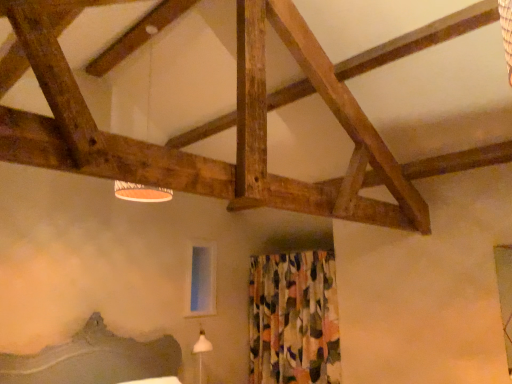
Question: From the image's perspective, is white fabric lampshade at upper center on top of transparent glass window screen at center?

Choices:
 (A) no
 (B) yes

Answer: (B)

Question: Does white fabric lampshade at upper center have a lesser width compared to transparent glass window screen at center?

Choices:
 (A) yes
 (B) no

Answer: (B)

Question: Is white fabric lampshade at upper center touching transparent glass window screen at center?

Choices:
 (A) yes
 (B) no

Answer: (B)

Question: From the image's perspective, does white fabric lampshade at upper center appear lower than transparent glass window screen at center?

Choices:
 (A) yes
 (B) no

Answer: (B)

Question: Is white fabric lampshade at upper center not near transparent glass window screen at center?

Choices:
 (A) yes
 (B) no

Answer: (B)

Question: In the image, is transparent glass window screen at center positioned in front of or behind white fabric lampshade at upper center?

Choices:
 (A) front
 (B) behind

Answer: (B)

Question: Looking at their shapes, would you say transparent glass window screen at center is wider or thinner than white fabric lampshade at upper center?

Choices:
 (A) wide
 (B) thin

Answer: (B)

Question: Would you say transparent glass window screen at center is to the left or to the right of white fabric lampshade at upper center in the picture?

Choices:
 (A) left
 (B) right

Answer: (B)

Question: Is transparent glass window screen at center taller or shorter than white fabric lampshade at upper center?

Choices:
 (A) tall
 (B) short

Answer: (B)

Question: Choose the correct answer: Is transparent glass window screen at center inside floral fabric curtain at center or outside it?

Choices:
 (A) inside
 (B) outside

Answer: (B)

Question: Is point (196, 246) positioned closer to the camera than point (312, 281)?

Choices:
 (A) farther
 (B) closer

Answer: (A)

Question: Considering the positions of transparent glass window screen at center and floral fabric curtain at center in the image, is transparent glass window screen at center taller or shorter than floral fabric curtain at center?

Choices:
 (A) short
 (B) tall

Answer: (A)

Question: Looking at the image, does transparent glass window screen at center seem bigger or smaller compared to floral fabric curtain at center?

Choices:
 (A) small
 (B) big

Answer: (A)

Question: Does point (117, 187) appear closer or farther from the camera than point (193, 281)?

Choices:
 (A) closer
 (B) farther

Answer: (A)

Question: Is white fabric lampshade at upper center situated inside transparent glass window screen at center or outside?

Choices:
 (A) inside
 (B) outside

Answer: (B)